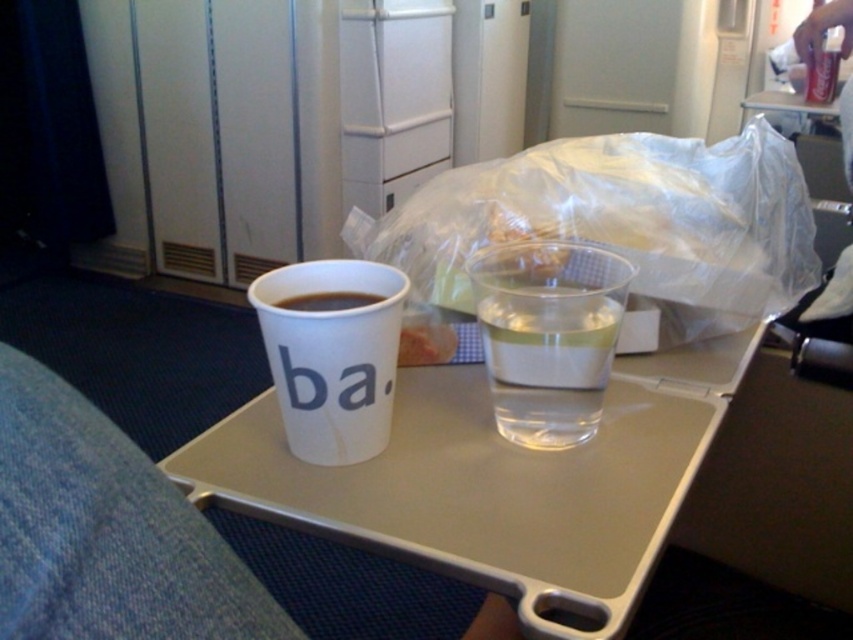
Question: In this image, where is white plastic tray at center located relative to matte white cup at center?

Choices:
 (A) below
 (B) above

Answer: (A)

Question: Which point is farther from the camera taking this photo?

Choices:
 (A) (346, 300)
 (B) (270, 497)
 (C) (579, 344)

Answer: (A)

Question: Which point is farther from the camera taking this photo?

Choices:
 (A) (525, 371)
 (B) (74, 540)
 (C) (286, 305)

Answer: (A)

Question: Does white plastic tray at center have a lesser width compared to white paper cup at upper center?

Choices:
 (A) yes
 (B) no

Answer: (B)

Question: Which object appears closest to the camera in this image?

Choices:
 (A) white paper cup at upper center
 (B) white paper cup at center

Answer: (A)

Question: Is clear plastic cup at center to the left of white paper cup at center from the viewer's perspective?

Choices:
 (A) yes
 (B) no

Answer: (B)